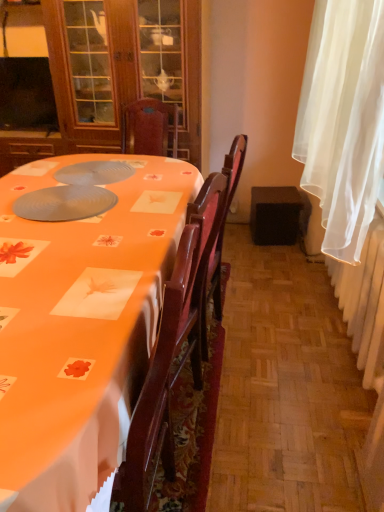
Image resolution: width=384 pixels, height=512 pixels. What do you see at coordinates (81, 323) in the screenshot? I see `orange fabric-covered table at lower left` at bounding box center [81, 323].

Locate an element on the screen. This screenshot has width=384, height=512. black fabric speaker at lower right is located at coordinates (275, 215).

What is the approximate width of white fabric radiator at right?

white fabric radiator at right is 7.49 inches wide.

Describe the element at coordinates (343, 120) in the screenshot. I see `white sheer curtain at right` at that location.

What are the coordinates of `orange fabric-covered table at lower left` in the screenshot? It's located at (81, 323).

Can you confirm if white sheer curtain at right is thinner than white fabric radiator at right?

In fact, white sheer curtain at right might be wider than white fabric radiator at right.

Does point (332, 249) come behind point (360, 309)?

No, (332, 249) is closer to viewer.

Based on their positions, is white sheer curtain at right located to the left or right of white fabric radiator at right?

Clearly, white sheer curtain at right is on the left of white fabric radiator at right in the image.

How many degrees apart are the facing directions of white sheer curtain at right and white fabric radiator at right?

The facing directions of white sheer curtain at right and white fabric radiator at right are 0.661 degrees apart.

Which object is wider, matte gray paper plate at center or matte wood cabinet at upper left?

matte wood cabinet at upper left.

From the image's perspective, which is below, matte gray paper plate at center or matte wood cabinet at upper left?

matte gray paper plate at center appears lower in the image.

Is matte gray paper plate at center to the left of matte wood cabinet at upper left from the viewer's perspective?

In fact, matte gray paper plate at center is to the right of matte wood cabinet at upper left.

Is matte gray paper plate at center further to camera compared to matte wood cabinet at upper left?

That is False.

Which object is positioned more to the right, black fabric speaker at lower right or matte gray paper plate at center?

Positioned to the right is black fabric speaker at lower right.

Locate an element on the screen. loudspeaker below the matte gray paper plate at center (from a real-world perspective) is located at coordinates (275, 215).

Is black fabric speaker at lower right far from matte gray paper plate at center?

That's right, there is a large distance between black fabric speaker at lower right and matte gray paper plate at center.

Which is nearer, (265,208) or (58,217)?

The point (58,217) is closer.

Is orange fabric-covered table at lower left positioned in front of black fabric speaker at lower right?

Yes, it is.

Can you confirm if orange fabric-covered table at lower left is taller than black fabric speaker at lower right?

Yes.

Does point (15, 308) appear closer or farther from the camera than point (254, 229)?

Clearly, point (15, 308) is closer to the camera than point (254, 229).

Does orange fabric-covered table at lower left turn towards black fabric speaker at lower right?

No, orange fabric-covered table at lower left is not aimed at black fabric speaker at lower right.

Where is `loudspeaker below the matte gray paper plate at center (from a real-world perspective)`? The image size is (384, 512). loudspeaker below the matte gray paper plate at center (from a real-world perspective) is located at coordinates (275, 215).

Measure the distance from matte gray paper plate at center to black fabric speaker at lower right.

matte gray paper plate at center is 5.08 feet from black fabric speaker at lower right.

From the image's perspective, is matte gray paper plate at center on black fabric speaker at lower right?

No, from the image's perspective, matte gray paper plate at center is not on top of black fabric speaker at lower right.

Can you confirm if matte gray paper plate at center is shorter than black fabric speaker at lower right?

Yes.

Is the depth of black fabric speaker at lower right greater than that of white fabric radiator at right?

That is True.

Is black fabric speaker at lower right not close to white fabric radiator at right?

No.

Can you confirm if black fabric speaker at lower right is bigger than white fabric radiator at right?

No.

Considering the relative sizes of black fabric speaker at lower right and white fabric radiator at right in the image provided, is black fabric speaker at lower right wider than white fabric radiator at right?

Yes.

Is point (341, 285) farther from viewer compared to point (89, 331)?

That is True.

Based on the photo, from a real-world perspective, does white fabric radiator at right sit lower than orange fabric-covered table at lower left?

Yes, from a real-world perspective, white fabric radiator at right is under orange fabric-covered table at lower left.

From the image's perspective, is white fabric radiator at right above or below orange fabric-covered table at lower left?

Clearly, from the image's perspective, white fabric radiator at right is above orange fabric-covered table at lower left.

Where is `curtain located above the white fabric radiator at right (from the image's perspective)`? curtain located above the white fabric radiator at right (from the image's perspective) is located at coordinates (343, 120).

The width and height of the screenshot is (384, 512). In order to click on paper plate that appears on the right of matte wood cabinet at upper left in this screenshot , I will do `click(64, 203)`.

When comparing their distances from matte gray paper plate at center, does white sheer curtain at right or matte wood cabinet at upper left seem further?

matte wood cabinet at upper left is further to matte gray paper plate at center.

Based on their spatial positions, is matte gray paper plate at center or orange fabric-covered table at lower left closer to matte wood cabinet at upper left?

matte gray paper plate at center.

Estimate the real-world distances between objects in this image. Which object is further from orange fabric-covered table at lower left, white fabric radiator at right or matte gray paper plate at center?

The object further to orange fabric-covered table at lower left is white fabric radiator at right.

Consider the image. When comparing their distances from white fabric radiator at right, does orange fabric-covered table at lower left or matte gray paper plate at center seem further?

matte gray paper plate at center.

Looking at this image, estimate the real-world distances between objects in this image. Which object is closer to white fabric radiator at right, white sheer curtain at right or orange fabric-covered table at lower left?

white sheer curtain at right is positioned closer to the anchor white fabric radiator at right.

Based on the photo, when comparing their distances from white sheer curtain at right, does white fabric radiator at right or orange fabric-covered table at lower left seem further?

orange fabric-covered table at lower left is positioned further to the anchor white sheer curtain at right.

Estimate the real-world distances between objects in this image. Which object is closer to white sheer curtain at right, matte gray paper plate at center or matte wood cabinet at upper left?

The object closer to white sheer curtain at right is matte gray paper plate at center.

Estimate the real-world distances between objects in this image. Which object is further from white sheer curtain at right, white fabric radiator at right or black fabric speaker at lower right?

black fabric speaker at lower right.

The height and width of the screenshot is (512, 384). Identify the location of paper plate between orange fabric-covered table at lower left and matte wood cabinet at upper left in the front-back direction. (64, 203).

You are a GUI agent. You are given a task and a screenshot of the screen. Output one action in this format:
    pyautogui.click(x=<x>, y=<y>)
    Task: Click on the cabinetry between white sheer curtain at right and black fabric speaker at lower right from front to back
    The height and width of the screenshot is (512, 384).
    Given the screenshot: What is the action you would take?
    pyautogui.click(x=99, y=76)

Identify the location of curtain situated between matte wood cabinet at upper left and white fabric radiator at right from left to right. (343, 120).

You are a GUI agent. You are given a task and a screenshot of the screen. Output one action in this format:
    pyautogui.click(x=<x>, y=<y>)
    Task: Click on the radiator between orange fabric-covered table at lower left and black fabric speaker at lower right in the front-back direction
    The image size is (384, 512).
    Given the screenshot: What is the action you would take?
    point(364,300)